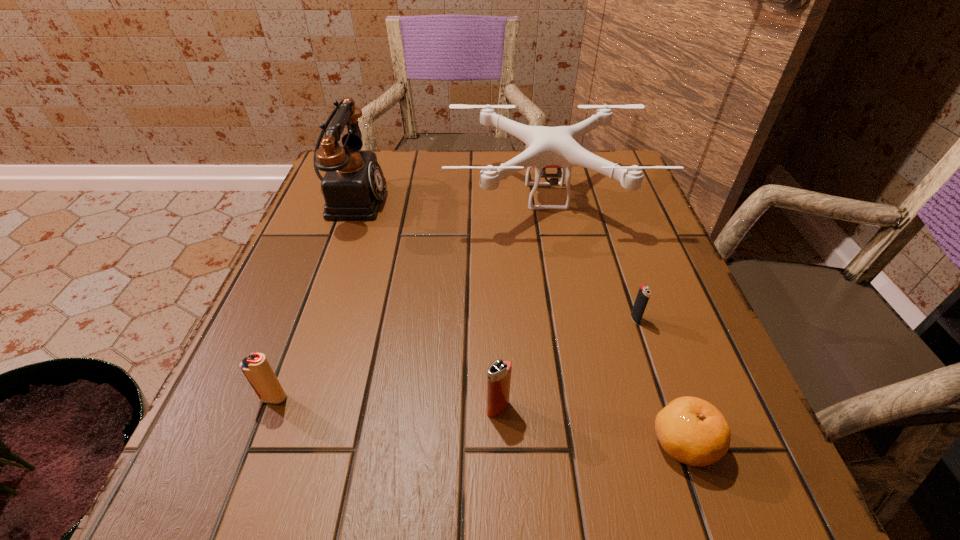
The height and width of the screenshot is (540, 960). I want to click on unoccupied position between the clementine and the rightmost igniter, so click(660, 381).

The image size is (960, 540). I want to click on free space between the clementine and the tallest object, so click(517, 320).

Find the location of a particular element. The height and width of the screenshot is (540, 960). vacant space that's between the drone and the telephone is located at coordinates (448, 197).

Image resolution: width=960 pixels, height=540 pixels. Identify the location of free spot between the shortest igniter and the second igniter from left to right. (566, 363).

The width and height of the screenshot is (960, 540). In order to click on free spot between the second igniter from left to right and the telephone in this screenshot , I will do `click(424, 303)`.

Locate an element on the screen. vacant area that lies between the telephone and the leftmost igniter is located at coordinates (312, 298).

Locate an element on the screen. The image size is (960, 540). free space between the clementine and the telephone is located at coordinates (517, 320).

Where is `unoccupied position between the tallest object and the leftmost igniter`? unoccupied position between the tallest object and the leftmost igniter is located at coordinates (312, 298).

The image size is (960, 540). Find the location of `empty space that is in between the second igniter from right to left and the clementine`. empty space that is in between the second igniter from right to left and the clementine is located at coordinates (590, 426).

The width and height of the screenshot is (960, 540). Identify the location of vacant area that lies between the leftmost igniter and the drone. (410, 297).